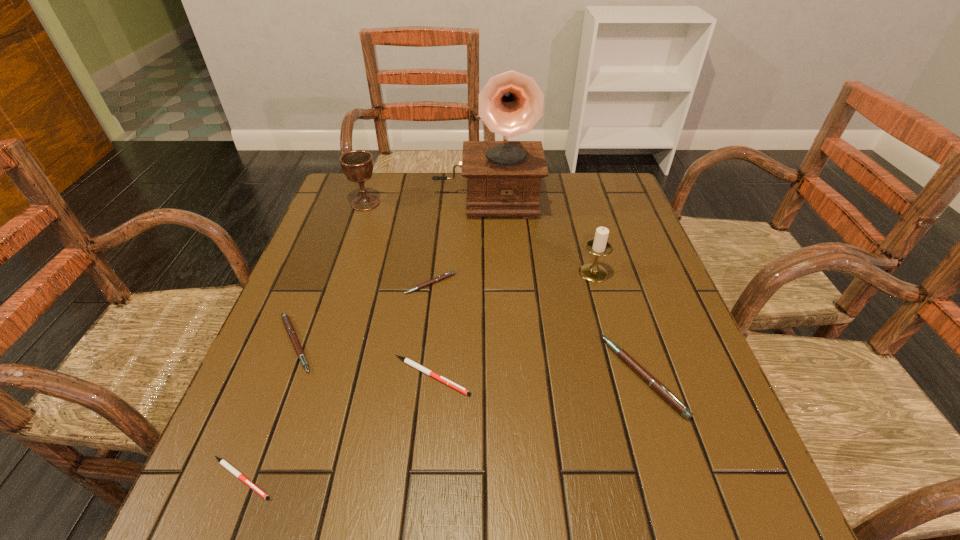
What are the coordinates of `vacant point located between the second pink pen from right to left and the smaller white pen` in the screenshot? It's located at (336, 381).

I want to click on free space between the candle holder and the shortest object, so click(x=418, y=375).

Identify the location of empty location between the nearest pen and the smallest pink pen. (336, 381).

This screenshot has width=960, height=540. Identify the location of vacant space in between the chalice and the farthest pink pen. (398, 244).

The width and height of the screenshot is (960, 540). In order to click on vacant space that's between the candle holder and the tallest pen in this screenshot , I will do `click(618, 325)`.

You are a GUI agent. You are given a task and a screenshot of the screen. Output one action in this format:
    pyautogui.click(x=<x>, y=<y>)
    Task: Click on the free space between the white candle holder and the bigger white pen
    
    Given the screenshot: What is the action you would take?
    pyautogui.click(x=513, y=325)

This screenshot has width=960, height=540. What are the coordinates of `vacant area that lies between the shortest object and the leftmost pink pen` in the screenshot? It's located at (269, 411).

Find the location of a particular element. This screenshot has width=960, height=540. empty location between the rightmost pen and the right white pen is located at coordinates (538, 376).

The width and height of the screenshot is (960, 540). I want to click on vacant point located between the fifth tallest object and the smallest pink pen, so click(363, 314).

Point out which object is positioned as the seventh nearest to the second pink pen from right to left. Please provide its 2D coordinates. Your answer should be formatted as a tuple, i.e. [(x, y)], where the tuple contains the x and y coordinates of a point satisfying the conditions above.

[(230, 468)]